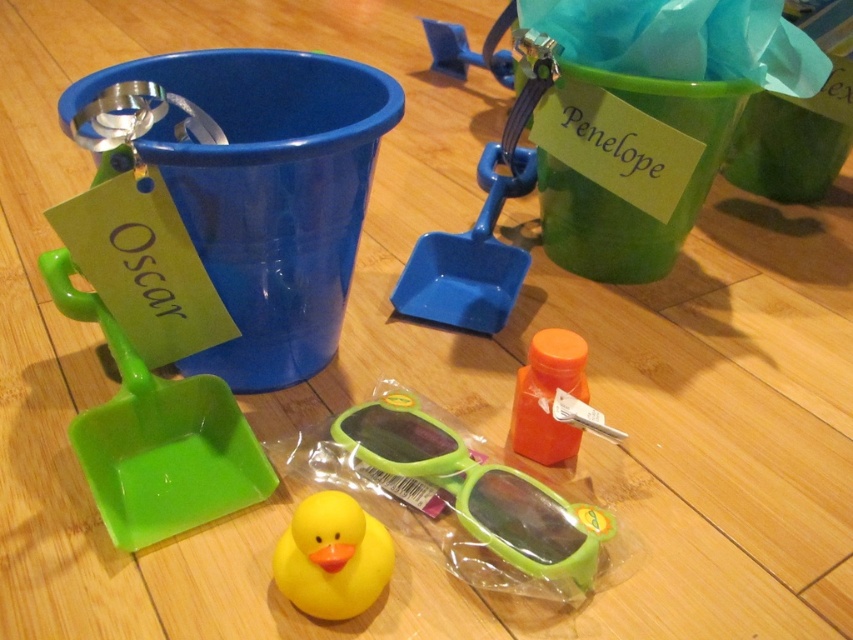
You are a child playing with the toys and want to grab the blue plastic shovel at center. Which direction should you move from the rubber duck at center to reach it?

The blue plastic shovel at center is to the right of the rubber duck at center, so you should move to the right to reach it.

Based on the photo, you are a child trying to find your blue plastic shovel at center. You see a point marked at coordinate (x=469, y=257). Is this point where your blue plastic shovel is located?

Yes, the point at coordinate (x=469, y=257) indicates the location of the blue plastic shovel at center.

You are a child trying to reach the orange matte bottle at center. There is a blue plastic shovel at center in the way. Can you move the shovel to get the bottle?

The blue plastic shovel at center is further to the viewer than the orange matte bottle at center, so you can move the shovel to access the bottle.